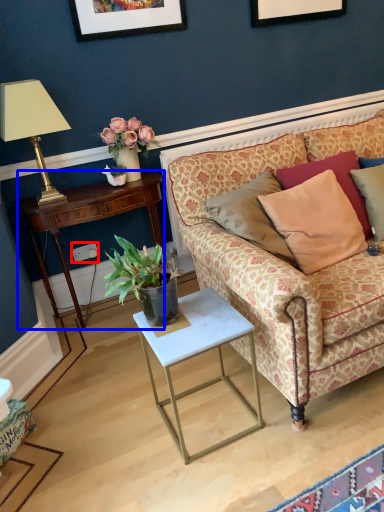
Question: Which object appears farthest to the camera in this image, power outlet (highlighted by a red box) or desk (highlighted by a blue box)?

Choices:
 (A) power outlet
 (B) desk

Answer: (A)